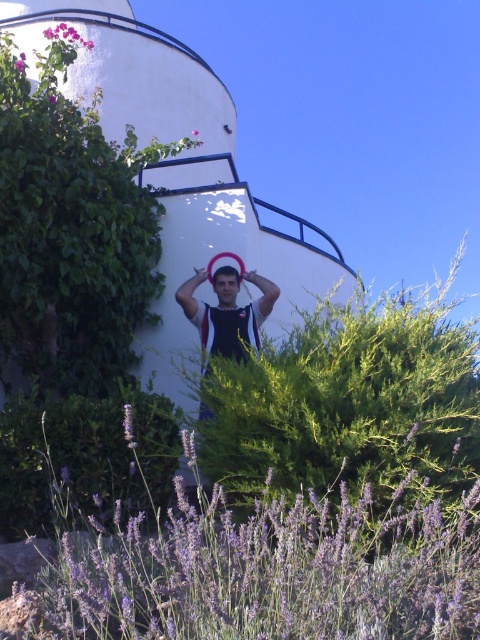
You are standing at the position of point (210, 282) and want to move to the position of point (231, 278). Based on the scene description, will you have to walk towards the man or away from him?

Point (231, 278) is in front of point (210, 282), so you would have to walk towards the man to reach it.

You are a photographer trying to capture the purple soft lavender at lower center and the matte black tank top at center in the same frame. Which object should you focus on first to ensure both are in focus, considering their heights?

The purple soft lavender at lower center has a lesser height compared to matte black tank top at center, so you should focus on the matte black tank top at center first as it is taller and will require adjusting the focus to include the shorter lavender.

You are a photographer adjusting the focus on your camera. The matte black tank top at center and the smooth skin head at center are both in the frame. If the minimum focus distance of your lens is 8 inches, will you be able to focus on both objects simultaneously?

The matte black tank top at center is 7.92 inches from the smooth skin head at center. Since the distance between them is less than the minimum focus distance of 8 inches, you can focus on both objects simultaneously.